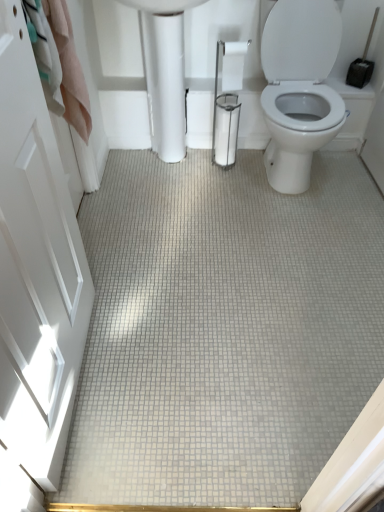
Question: Does white glossy door at left turn towards white glossy porcelain at center?

Choices:
 (A) no
 (B) yes

Answer: (A)

Question: Is white glossy door at left next to white glossy porcelain at center?

Choices:
 (A) no
 (B) yes

Answer: (A)

Question: Is white glossy door at left to the right of white glossy porcelain at center from the viewer's perspective?

Choices:
 (A) yes
 (B) no

Answer: (B)

Question: Can you confirm if white glossy door at left is bigger than white glossy porcelain at center?

Choices:
 (A) yes
 (B) no

Answer: (B)

Question: From the image's perspective, does white glossy door at left appear lower than white glossy porcelain at center?

Choices:
 (A) yes
 (B) no

Answer: (A)

Question: Is white glossy porcelain at center completely or partially inside white glossy door at left?

Choices:
 (A) yes
 (B) no

Answer: (B)

Question: Is white glossy door at left further to camera compared to white glossy toilet paper at center?

Choices:
 (A) no
 (B) yes

Answer: (A)

Question: Does white glossy door at left have a larger size compared to white glossy toilet paper at center?

Choices:
 (A) no
 (B) yes

Answer: (B)

Question: From the image's perspective, is white glossy door at left over white glossy toilet paper at center?

Choices:
 (A) yes
 (B) no

Answer: (B)

Question: Is white glossy toilet paper at center located within white glossy door at left?

Choices:
 (A) yes
 (B) no

Answer: (B)

Question: Is white glossy door at left next to white glossy toilet paper at center?

Choices:
 (A) no
 (B) yes

Answer: (A)

Question: Could you tell me if white glossy door at left is turned towards white glossy toilet paper at center?

Choices:
 (A) no
 (B) yes

Answer: (A)

Question: Could you tell me if white glossy toilet paper at center is facing white glossy porcelain at center?

Choices:
 (A) no
 (B) yes

Answer: (A)